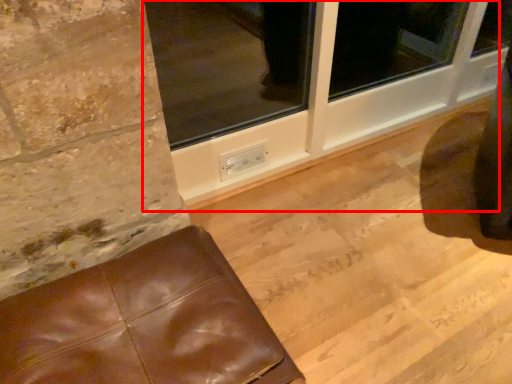
Question: From the image's perspective, what is the correct spatial relationship of window frame (annotated by the red box) in relation to furniture?

Choices:
 (A) below
 (B) above

Answer: (B)